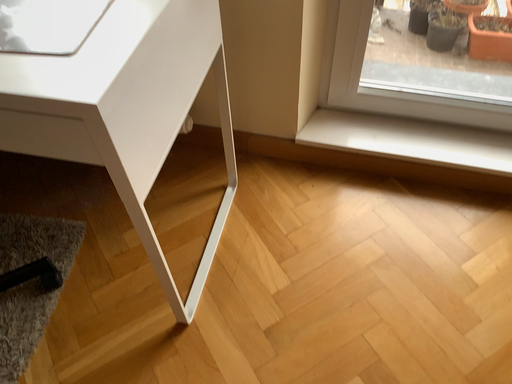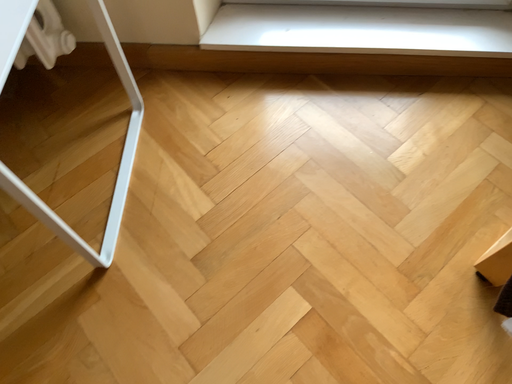
Question: Which way did the camera rotate in the video?

Choices:
 (A) rotated upward
 (B) rotated downward

Answer: (B)